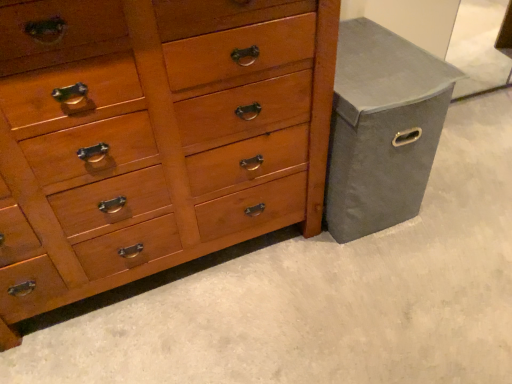
Where is `vacant area that lies between shiny wood chest of drawers at center and matte gray fabric bin at right`? The width and height of the screenshot is (512, 384). vacant area that lies between shiny wood chest of drawers at center and matte gray fabric bin at right is located at coordinates (237, 275).